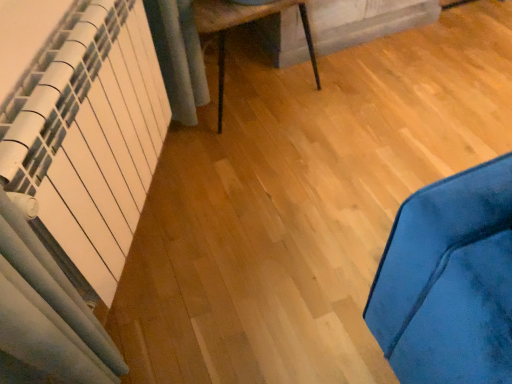
Identify the location of free space in front of wooden table at center. Image resolution: width=512 pixels, height=384 pixels. (281, 183).